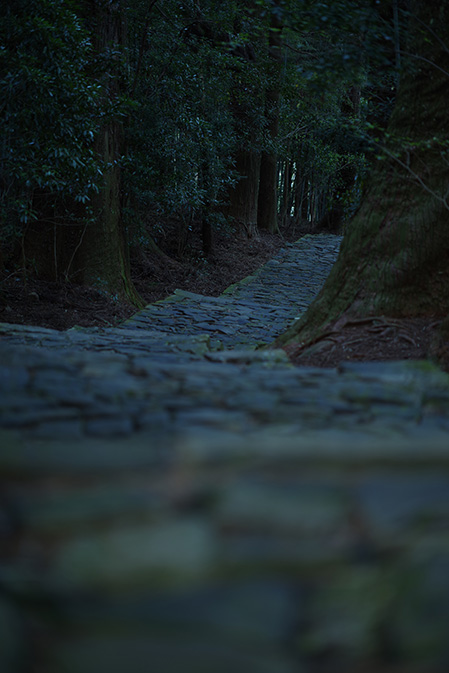
This screenshot has width=449, height=673. I want to click on light, so click(292, 176).